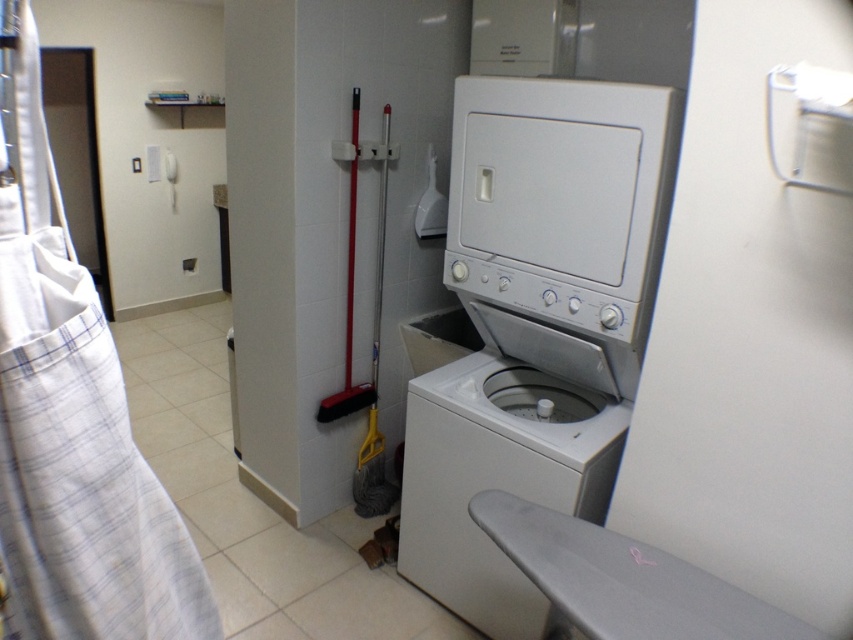
Is white plaid fabric at left behind white plastic washing machine at lower center?

No, it is not.

Is white plaid fabric at left below white plastic washing machine at lower center?

Actually, white plaid fabric at left is above white plastic washing machine at lower center.

Which is behind, point (10, 458) or point (473, 550)?

Point (473, 550)

Locate an element on the screen. white plaid fabric at left is located at coordinates (71, 417).

Does white plastic washing machine at center have a lesser height compared to white plaid fabric at left?

No.

Does point (584, 509) come closer to viewer compared to point (99, 490)?

That is False.

Between point (480, 486) and point (35, 83), which one is positioned in front?

Point (35, 83)

At what (x,y) coordinates should I click in order to perform the action: click on white plastic washing machine at center. Please return your answer as a coordinate pair (x, y). The image size is (853, 640). Looking at the image, I should click on (535, 323).

Does white plastic washing machine at center appear on the right side of white plastic washing machine at lower center?

Yes, white plastic washing machine at center is to the right of white plastic washing machine at lower center.

Does point (645, 132) come farther from viewer compared to point (473, 424)?

No, it is in front of (473, 424).

Image resolution: width=853 pixels, height=640 pixels. What do you see at coordinates (535, 323) in the screenshot? I see `white plastic washing machine at center` at bounding box center [535, 323].

Find the location of a particular element. white plastic washing machine at center is located at coordinates (535, 323).